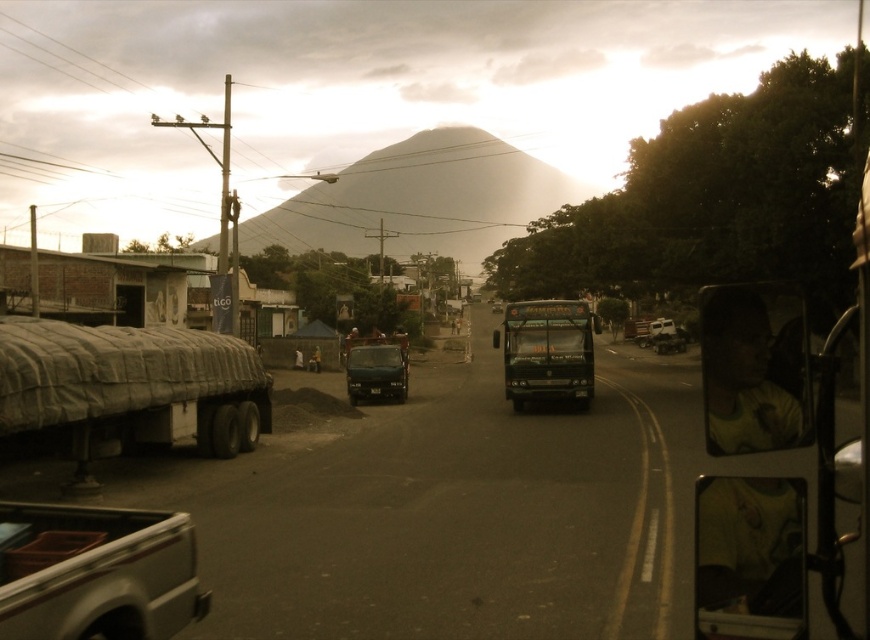
Identify the location of textured gray tarpaulin at left. The image size is (870, 640). (129, 387).

Find the location of a particular element. textured gray tarpaulin at left is located at coordinates (129, 387).

Who is positioned more to the left, matte black van at center or metallic blue truck at center?

From the viewer's perspective, matte black van at center appears more on the left side.

Does matte black van at center have a greater height compared to metallic blue truck at center?

Incorrect, matte black van at center's height is not larger of metallic blue truck at center's.

The image size is (870, 640). Find the location of `matte black van at center`. matte black van at center is located at coordinates (376, 372).

Where is `matte black van at center`? matte black van at center is located at coordinates (376, 372).

Which is in front, point (57, 342) or point (155, 592)?

Point (155, 592) is more forward.

At what (x,y) coordinates should I click in order to perform the action: click on textured gray tarpaulin at left. Please return your answer as a coordinate pair (x, y). Looking at the image, I should click on (129, 387).